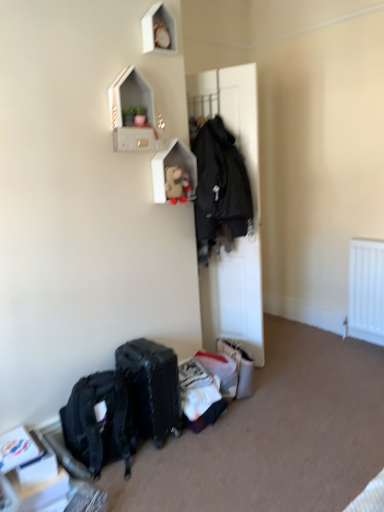
Question: Could you tell me if black matte door at center is facing matte black suitcase at lower center?

Choices:
 (A) yes
 (B) no

Answer: (B)

Question: From the image's perspective, does black matte door at center appear lower than matte black suitcase at lower center?

Choices:
 (A) yes
 (B) no

Answer: (B)

Question: Considering the relative sizes of black matte door at center and matte black suitcase at lower center in the image provided, is black matte door at center bigger than matte black suitcase at lower center?

Choices:
 (A) yes
 (B) no

Answer: (A)

Question: Is black matte door at center taller than matte black suitcase at lower center?

Choices:
 (A) no
 (B) yes

Answer: (B)

Question: Is black matte door at center positioned beyond the bounds of matte black suitcase at lower center?

Choices:
 (A) no
 (B) yes

Answer: (B)

Question: Is concrete textured shelf at upper center, which is the first shelf from front to back, taller or shorter than matte black suitcase at lower center?

Choices:
 (A) tall
 (B) short

Answer: (B)

Question: From the image's perspective, is concrete textured shelf at upper center, placed as the 2th shelf when sorted from back to front, positioned above or below matte black suitcase at lower center?

Choices:
 (A) below
 (B) above

Answer: (B)

Question: From a real-world perspective, is concrete textured shelf at upper center, placed as the 2th shelf when sorted from back to front, above or below matte black suitcase at lower center?

Choices:
 (A) above
 (B) below

Answer: (A)

Question: Considering the positions of concrete textured shelf at upper center, placed as the 2th shelf when sorted from back to front, and matte black suitcase at lower center in the image, is concrete textured shelf at upper center, placed as the 2th shelf when sorted from back to front, wider or thinner than matte black suitcase at lower center?

Choices:
 (A) thin
 (B) wide

Answer: (A)

Question: Is point (193, 156) positioned closer to the camera than point (167, 348)?

Choices:
 (A) farther
 (B) closer

Answer: (A)

Question: From their relative heights in the image, would you say wooden shelf at upper center, arranged as the first shelf when viewed from the back, is taller or shorter than matte black suitcase at lower center?

Choices:
 (A) tall
 (B) short

Answer: (B)

Question: From the image's perspective, is wooden shelf at upper center, marked as the second shelf in a front-to-back arrangement, positioned above or below matte black suitcase at lower center?

Choices:
 (A) below
 (B) above

Answer: (B)

Question: Is wooden shelf at upper center, arranged as the first shelf when viewed from the back, situated inside matte black suitcase at lower center or outside?

Choices:
 (A) inside
 (B) outside

Answer: (B)

Question: Would you say black matte door at center is inside or outside wooden shelf at upper center, marked as the second shelf in a front-to-back arrangement?

Choices:
 (A) inside
 (B) outside

Answer: (B)

Question: Is point (235, 248) closer or farther from the camera than point (152, 167)?

Choices:
 (A) farther
 (B) closer

Answer: (A)